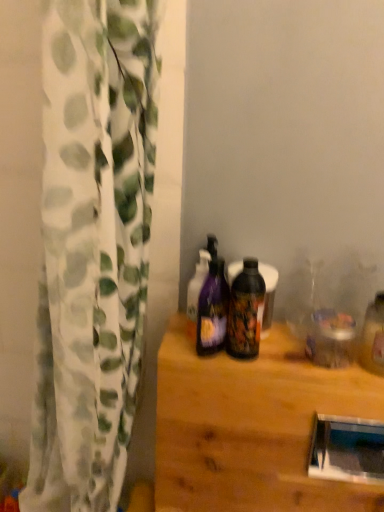
This screenshot has width=384, height=512. I want to click on blank space situated above wooden table at center (from a real-world perspective), so click(x=301, y=350).